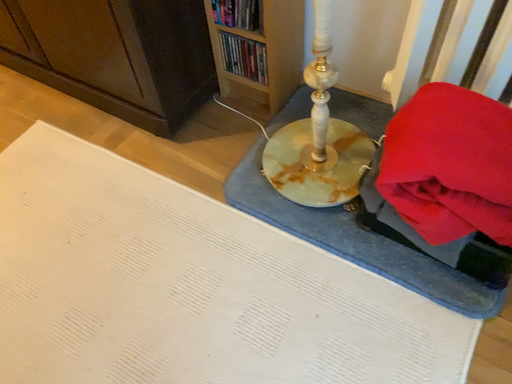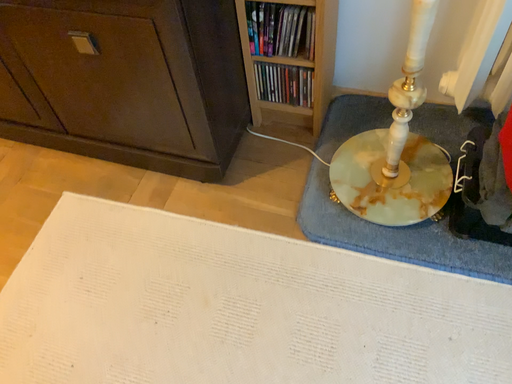
Question: Which way did the camera rotate in the video?

Choices:
 (A) rotated right
 (B) rotated left

Answer: (A)